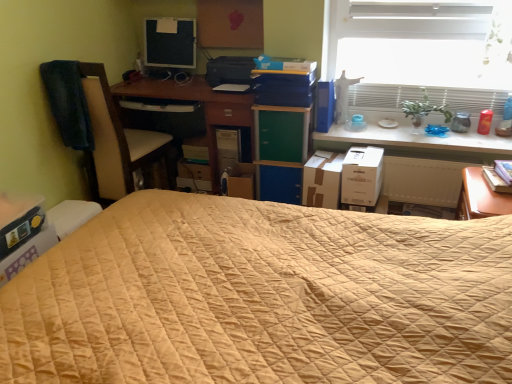
Locate an element on the screen. This screenshot has width=512, height=384. brown leather swivel chair at left is located at coordinates (119, 142).

This screenshot has height=384, width=512. What do you see at coordinates (322, 180) in the screenshot? I see `brown cardboard box at center, which ranks as the 2th cardboard box in left-to-right order` at bounding box center [322, 180].

Image resolution: width=512 pixels, height=384 pixels. I want to click on beige quilted bed at center, so click(x=262, y=297).

Where is `white glossy table at upper right`? This screenshot has height=384, width=512. white glossy table at upper right is located at coordinates (412, 140).

Identify the location of green glossy plant at upper right. This screenshot has height=384, width=512. (424, 109).

Between hardcover book at right, the 1th paperback book from the right, and beige quilted bed at center, which one has smaller size?

Smaller between the two is hardcover book at right, the 1th paperback book from the right.

Relative to beige quilted bed at center, is hardcover book at right, the 1th paperback book from the right, in front or behind?

Visually, hardcover book at right, the 1th paperback book from the right, is located behind beige quilted bed at center.

From a real-world perspective, between hardcover book at right, the fourth paperback book from the left, and beige quilted bed at center, who is vertically higher?

hardcover book at right, the fourth paperback book from the left, from a real-world perspective.

Is hardcover book at right, the 1th paperback book from the right, positioned far away from beige quilted bed at center?

hardcover book at right, the 1th paperback book from the right, is far away from beige quilted bed at center.

Looking at this image, measure the distance between brown leather swivel chair at left and green matte file cabinet at center.

brown leather swivel chair at left is 35.94 inches from green matte file cabinet at center.

In the image, is brown leather swivel chair at left on the left side or the right side of green matte file cabinet at center?

From the image, it's evident that brown leather swivel chair at left is to the left of green matte file cabinet at center.

Is brown leather swivel chair at left smaller than green matte file cabinet at center?

Incorrect, brown leather swivel chair at left is not smaller in size than green matte file cabinet at center.

Is green glossy plant at upper right surrounding matte black monitor at upper left?

No, matte black monitor at upper left is not inside green glossy plant at upper right.

How far apart are green glossy plant at upper right and matte black monitor at upper left?

A distance of 5.57 feet exists between green glossy plant at upper right and matte black monitor at upper left.

In terms of width, does green glossy plant at upper right look wider or thinner when compared to matte black monitor at upper left?

In the image, green glossy plant at upper right appears to be wider than matte black monitor at upper left.

Considering the positions of objects green glossy plant at upper right and matte black monitor at upper left in the image provided, who is more to the left, green glossy plant at upper right or matte black monitor at upper left?

From the viewer's perspective, matte black monitor at upper left appears more on the left side.

Is brown leather swivel chair at left not inside beige quilted bed at center?

brown leather swivel chair at left lies outside beige quilted bed at center's area.

Is brown leather swivel chair at left facing away from beige quilted bed at center?

No.

Is point (104, 187) positioned in front of point (438, 270)?

That is False.

Is brown leather swivel chair at left next to beige quilted bed at center?

brown leather swivel chair at left and beige quilted bed at center are clearly separated.

Who is shorter, transparent glass window at upper right or white glossy table at upper right?

Standing shorter between the two is white glossy table at upper right.

From the picture: Based on their positions, is transparent glass window at upper right located to the left or right of white glossy table at upper right?

In the image, transparent glass window at upper right appears on the right side of white glossy table at upper right.

Find the location of `table lying below the transparent glass window at upper right (from the image's perspective)`. table lying below the transparent glass window at upper right (from the image's perspective) is located at coordinates tap(412, 140).

Looking at this image, is hardcover book at right, the fourth paperback book from the left, facing away from cardboard box at lower left, marked as the third cardboard box in a right-to-left arrangement?

hardcover book at right, the fourth paperback book from the left, is not turned away from cardboard box at lower left, marked as the third cardboard box in a right-to-left arrangement.

Does hardcover book at right, the 1th paperback book from the right, have a greater width compared to cardboard box at lower left, marked as the third cardboard box in a right-to-left arrangement?

Incorrect, the width of hardcover book at right, the 1th paperback book from the right, does not surpass that of cardboard box at lower left, marked as the third cardboard box in a right-to-left arrangement.

Image resolution: width=512 pixels, height=384 pixels. I want to click on the 1st paperback book behind the cardboard box at lower left, marked as the third cardboard box in a right-to-left arrangement, so click(495, 180).

In the scene shown: Are hardcover book at right, the 1th paperback book from the right, and cardboard box at lower left, placed as the 1th cardboard box when sorted from left to right, making contact?

No, hardcover book at right, the 1th paperback book from the right, is not next to cardboard box at lower left, placed as the 1th cardboard box when sorted from left to right.

Which is closer to the camera, [325,99] or [231,137]?

Clearly, point [325,99] is closer to the camera than point [231,137].

Is blue matte book at upper right, the third paperback book in the left-to-right sequence, facing towards matte black computer tower at center?

No, blue matte book at upper right, the third paperback book in the left-to-right sequence, is not turned towards matte black computer tower at center.

Is blue matte book at upper right, the third paperback book in the left-to-right sequence, to the left or to the right of matte black computer tower at center in the image?

In the image, blue matte book at upper right, the third paperback book in the left-to-right sequence, appears on the right side of matte black computer tower at center.

Are blue matte book at upper right, the second paperback book from the right, and matte black computer tower at center making contact?

blue matte book at upper right, the second paperback book from the right, and matte black computer tower at center are clearly separated.

Where is `bed below the hardcover book at right, the 1th paperback book from the right (from the image's perspective)`? The image size is (512, 384). bed below the hardcover book at right, the 1th paperback book from the right (from the image's perspective) is located at coordinates (262, 297).

What are the coordinates of `file cabinet on the right of brown leather swivel chair at left` in the screenshot? It's located at (280, 151).

Considering their positions, is blue matte book at upper right, the second paperback book from the right, positioned closer to brown leather swivel chair at left than cardboard box at lower left, marked as the third cardboard box in a right-to-left arrangement?

cardboard box at lower left, marked as the third cardboard box in a right-to-left arrangement, lies closer to brown leather swivel chair at left than the other object.

From the image, which object appears to be nearer to white cardboard box at right, which ranks as the first cardboard box in right-to-left order, green matte/blackboard at center, the second paperback book when ordered from left to right, or blue matte book at upper right, the third paperback book in the left-to-right sequence?

blue matte book at upper right, the third paperback book in the left-to-right sequence, is positioned closer to the anchor white cardboard box at right, which ranks as the first cardboard box in right-to-left order.

Which object lies further to the anchor point green matte/blackboard at center, placed as the 3th paperback book when sorted from right to left, transparent glass window at upper right or white cardboard box at right, which ranks as the first cardboard box in right-to-left order?

Based on the image, transparent glass window at upper right appears to be further to green matte/blackboard at center, placed as the 3th paperback book when sorted from right to left.

Consider the image. Estimate the real-world distances between objects in this image. Which object is further from wooden desk at center, matte black monitor at upper left or brown leather swivel chair at left?

brown leather swivel chair at left lies further to wooden desk at center than the other object.

Considering their positions, is brown leather swivel chair at left positioned further to green glossy plant at upper right than green matte file cabinet at center?

Based on the image, brown leather swivel chair at left appears to be further to green glossy plant at upper right.

Considering their positions, is brown leather swivel chair at left positioned further to wooden desk at center than matte black monitor at upper left?

brown leather swivel chair at left.

Considering their positions, is beige quilted bed at center positioned further to white cardboard box at right, the 3th cardboard box when ordered from left to right, than green matte file cabinet at center?

beige quilted bed at center lies further to white cardboard box at right, the 3th cardboard box when ordered from left to right, than the other object.

Looking at the image, which one is located further to cardboard box at lower left, marked as the third cardboard box in a right-to-left arrangement, transparent glass window at upper right or wooden desk at center?

transparent glass window at upper right lies further to cardboard box at lower left, marked as the third cardboard box in a right-to-left arrangement, than the other object.

The image size is (512, 384). I want to click on desk that lies between matte black monitor at upper left and cardboard box at lower left, marked as the third cardboard box in a right-to-left arrangement, from top to bottom, so click(x=204, y=110).

Find the location of a particular element. The height and width of the screenshot is (384, 512). desk between cardboard box at lower left, placed as the 1th cardboard box when sorted from left to right, and brown cardboard box at center, the 2th cardboard box in the right-to-left sequence, from left to right is located at coordinates (204, 110).

The height and width of the screenshot is (384, 512). What are the coordinates of `swivel chair between beige quilted bed at center and brown cardboard box at center, which ranks as the 2th cardboard box in left-to-right order, in the front-back direction` in the screenshot? It's located at (119, 142).

This screenshot has height=384, width=512. Identify the location of window between matte black monitor at upper left and hardcover book at right, the fourth paperback book from the left. (420, 52).